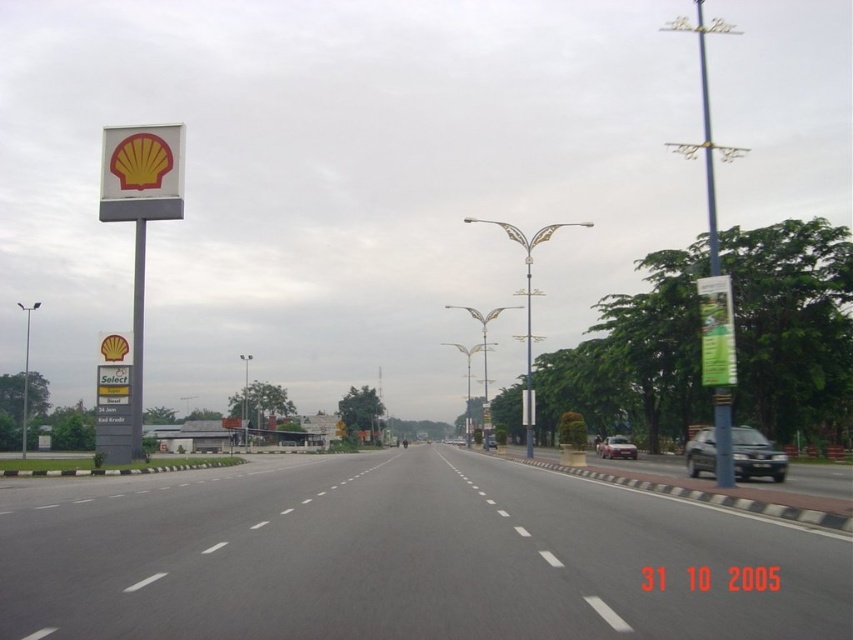
You are a GPS system trying to guide a driver to the Shell gas station on the left side of the road. The driver is currently on the black asphalt highway at center. According to the image, what direction should the driver turn to reach the Shell gas station?

Answer: The Shell gas station is on the left side of the road, so the driver should turn left from the black asphalt highway at center to reach it.

You are driving a car that is 15 feet long. You want to park your car between the black asphalt highway at center and the metallic gray signpost at left. Is there enough space to park your car there?

The distance between the black asphalt highway at center and the metallic gray signpost at left is 56.91 feet. Since your car is only 15 feet long, there is more than enough space to park your car between them.

You are driving a car and see the blue metallic pole at upper right and the metallic gray signpost at left. Which object is closer to your current position?

The blue metallic pole at upper right is closer to your current position because it is in front of the metallic gray signpost at left.